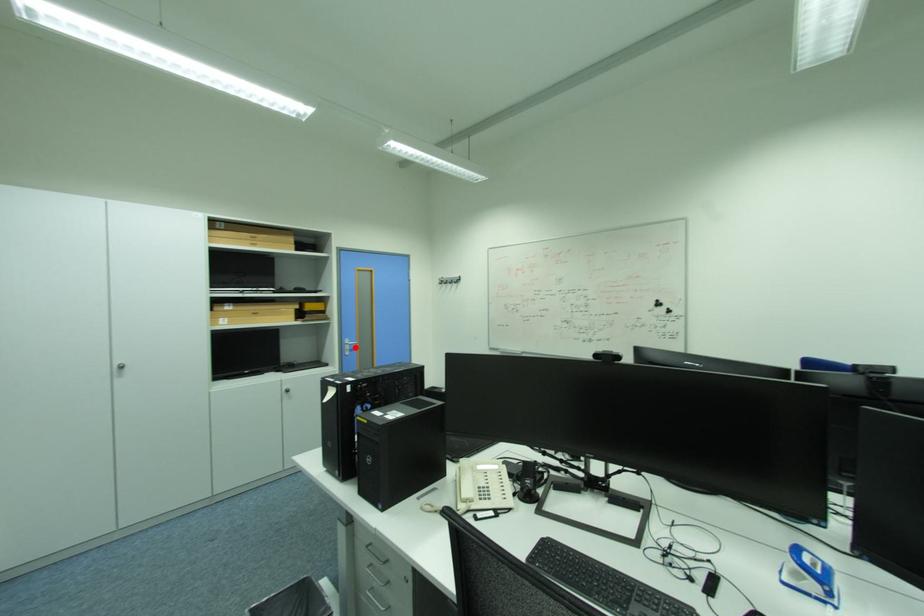
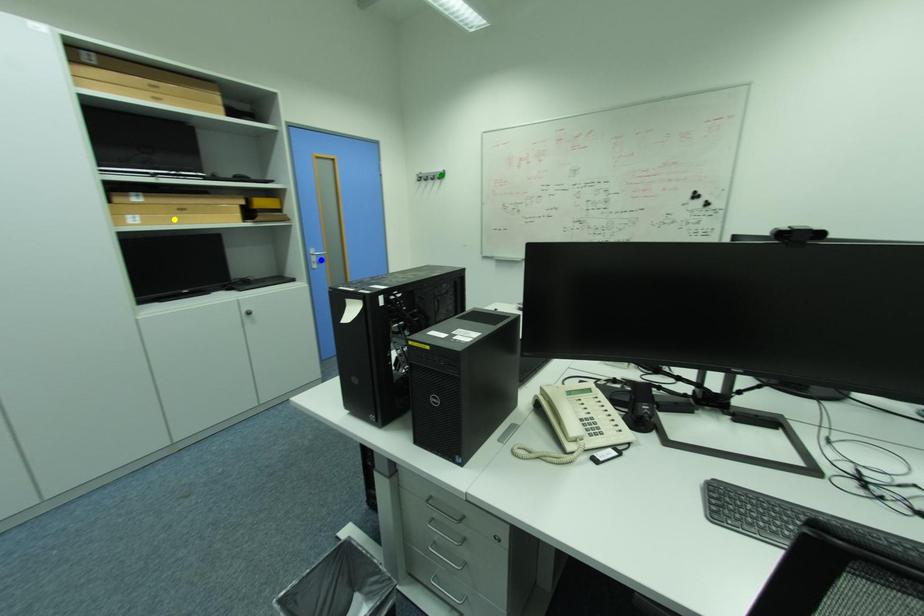
Question: I am providing you with two images of the same scene from different viewpoints. A red point is marked on the first image. You are given multiple points on the second image. Which mark in image 2 goes with the point in image 1?

Choices:
 (A) green point
 (B) blue point
 (C) yellow point

Answer: (B)